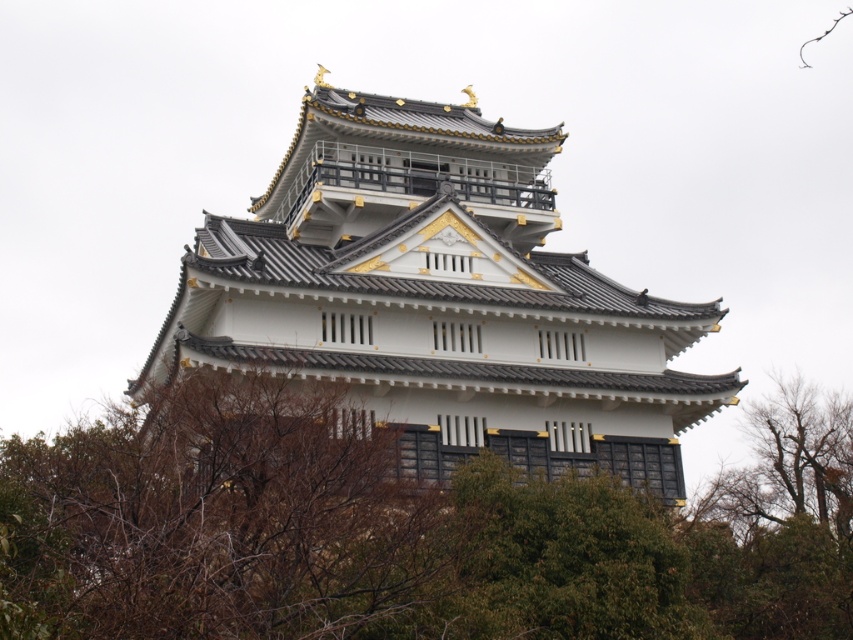
You are standing in front of the traditional Japanese building and notice two points marked on the structure. The first point is at coordinates point (x=323, y=458) and the second is at point (x=323, y=205). Which of these two points is nearer to your current position?

Point (x=323, y=458) is closer to the camera than point (x=323, y=205), so the first point is nearer to your current position.

You are a visitor standing in front of the traditional Japanese building. You notice a green leafy tree at center and a white painted wood tower at center. Which object do you think has a larger width?

The green leafy tree at center might be wider than white painted wood tower at center, so it likely has a larger width.